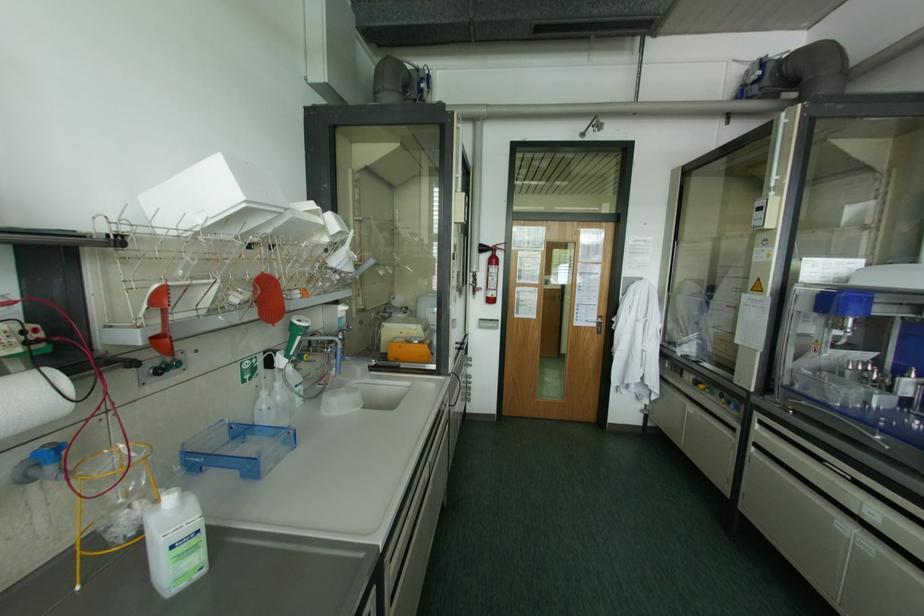
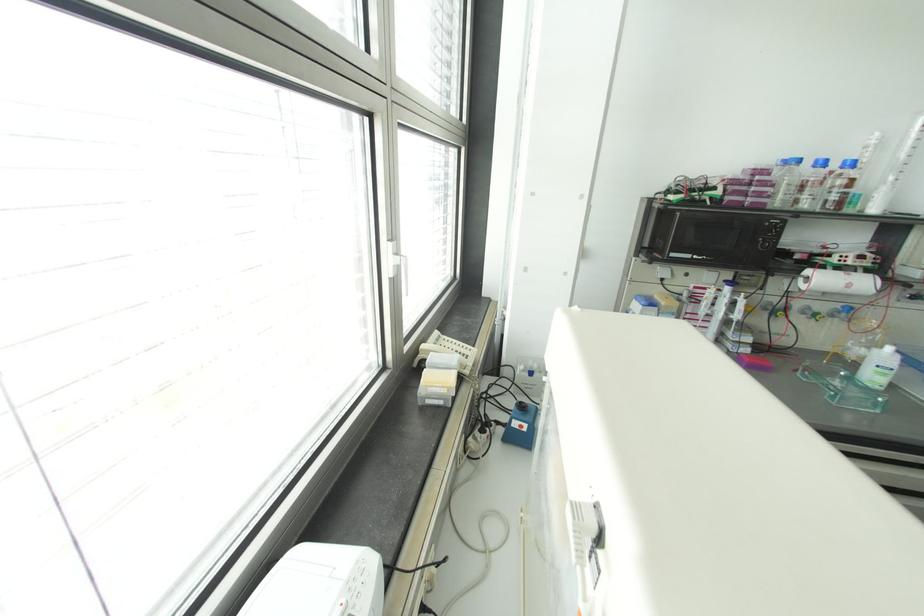
The point at (190, 499) is marked in the first image. Where is the corresponding point in the second image?

(898, 355)